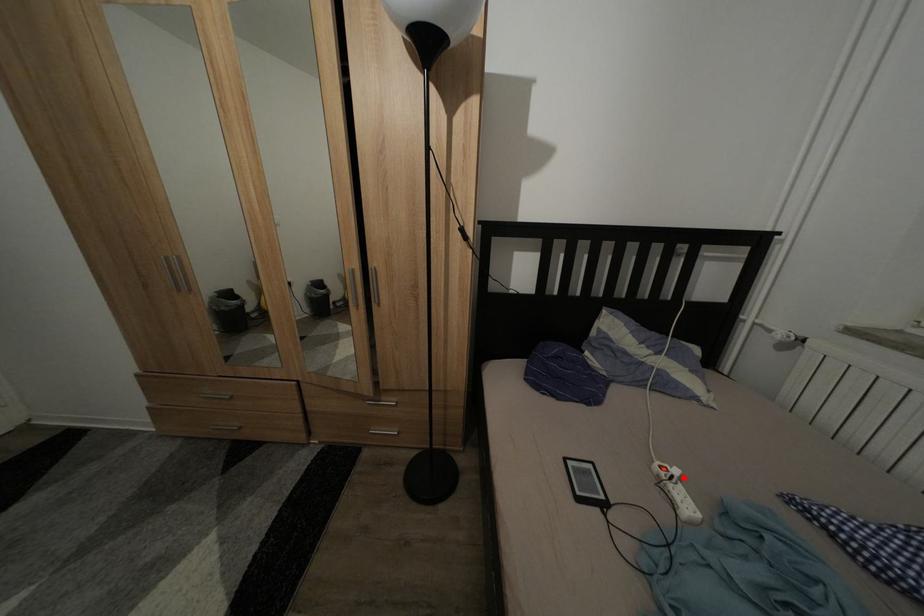
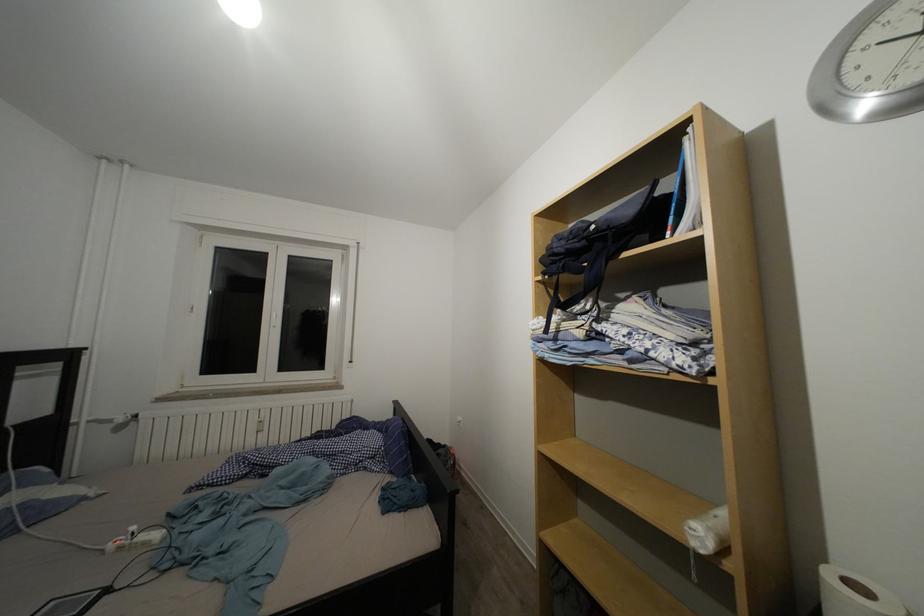
Question: I am providing you with two images of the same scene from different viewpoints. A red point is shown in image1. For the corresponding object point in image2, is it positioned nearer or farther from the camera?

Choices:
 (A) Nearer
 (B) Farther

Answer: (A)